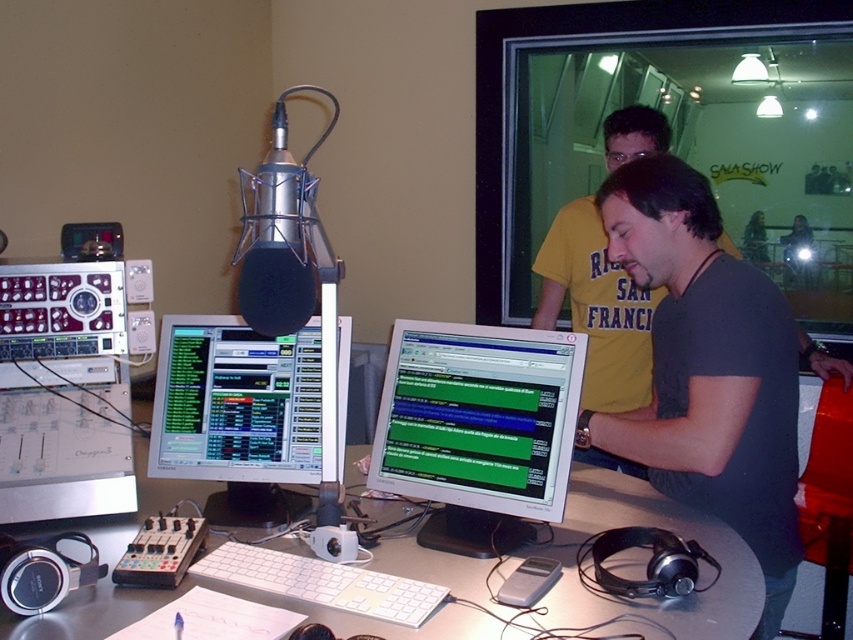
Question: Which of the following is the closest to the observer?

Choices:
 (A) silver metallic desk at center
 (B) matte black microphone at center
 (C) white glossy monitor at center
 (D) black matte shirt at center

Answer: (B)

Question: Does black matte shirt at center have a greater width compared to silver metallic desk at center?

Choices:
 (A) no
 (B) yes

Answer: (A)

Question: Does black matte shirt at center appear on the left side of matte black microphone at center?

Choices:
 (A) no
 (B) yes

Answer: (A)

Question: Can you confirm if matte black monitor at center is positioned to the left of matte black microphone at center?

Choices:
 (A) yes
 (B) no

Answer: (A)

Question: Which object appears closest to the camera in this image?

Choices:
 (A) matte black monitor at center
 (B) black matte shirt at center

Answer: (B)

Question: Among these objects, which one is nearest to the camera?

Choices:
 (A) black matte shirt at center
 (B) matte black microphone at center
 (C) silver metallic desk at center

Answer: (B)